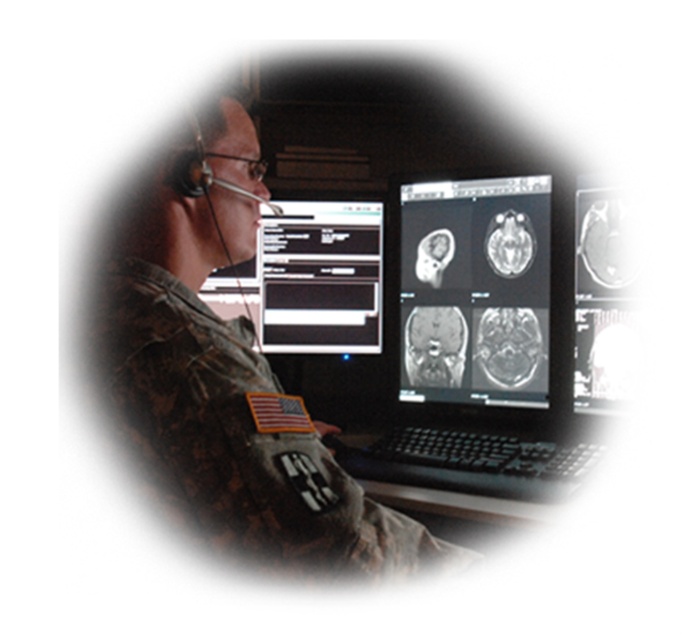
Question: Considering the relative positions of camouflage uniform at center and black glossy text box at center in the image provided, where is camouflage uniform at center located with respect to black glossy text box at center?

Choices:
 (A) below
 (B) above

Answer: (A)

Question: Which object appears farthest from the camera in this image?

Choices:
 (A) camouflage uniform at center
 (B) black matte brain scan at center

Answer: (B)

Question: Is black matte brain scan at center smaller than black glossy text box at center?

Choices:
 (A) no
 (B) yes

Answer: (A)

Question: Which of these objects is positioned closest to the black matte brain scan at center?

Choices:
 (A) black glossy text box at center
 (B) camouflage uniform at center

Answer: (A)

Question: Is camouflage uniform at center in front of black matte brain scan at center?

Choices:
 (A) yes
 (B) no

Answer: (A)

Question: Which is nearer to the camouflage uniform at center?

Choices:
 (A) black glossy text box at center
 (B) black matte brain scan at center

Answer: (B)